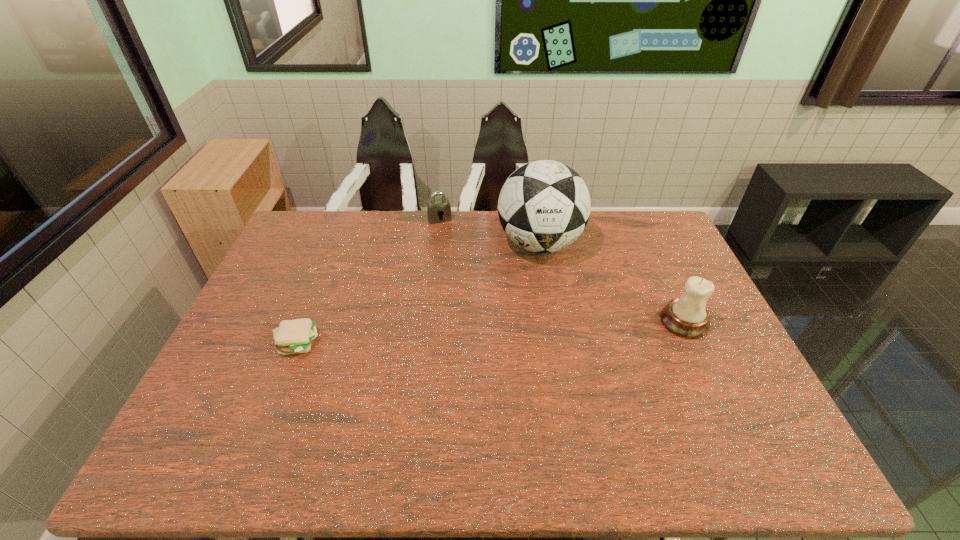
What are the coordinates of `free space that is in between the candle holder and the tallest object` in the screenshot? It's located at (612, 282).

You are a GUI agent. You are given a task and a screenshot of the screen. Output one action in this format:
    pyautogui.click(x=<x>, y=<y>)
    Task: Click on the free space between the third object from left to right and the second shortest object
    The width and height of the screenshot is (960, 540).
    Given the screenshot: What is the action you would take?
    pyautogui.click(x=490, y=232)

Locate an element on the screen. vacant area between the third shortest object and the leftmost object is located at coordinates (491, 332).

Identify the location of vacant point located between the shortest object and the padlock. Image resolution: width=960 pixels, height=540 pixels. (369, 281).

Where is `free space between the second object from left to right and the candle holder`? This screenshot has width=960, height=540. free space between the second object from left to right and the candle holder is located at coordinates (562, 271).

The height and width of the screenshot is (540, 960). I want to click on object identified as the second closest to the soccer ball, so click(x=687, y=317).

The width and height of the screenshot is (960, 540). What are the coordinates of `object that is the closest to the tallest object` in the screenshot? It's located at (440, 208).

Locate an element on the screen. Image resolution: width=960 pixels, height=540 pixels. vacant area that satisfies the following two spatial constraints: 1. on the front side of the second shortest object; 2. on the right side of the candle holder is located at coordinates (427, 321).

Locate an element on the screen. The width and height of the screenshot is (960, 540). free spot that satisfies the following two spatial constraints: 1. on the front side of the second tallest object; 2. on the right side of the second object from right to left is located at coordinates (552, 321).